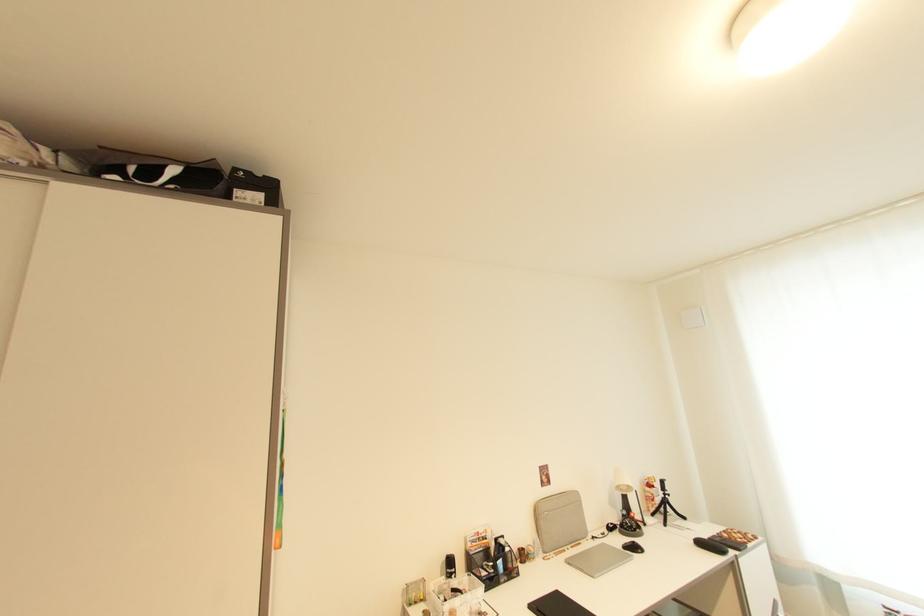
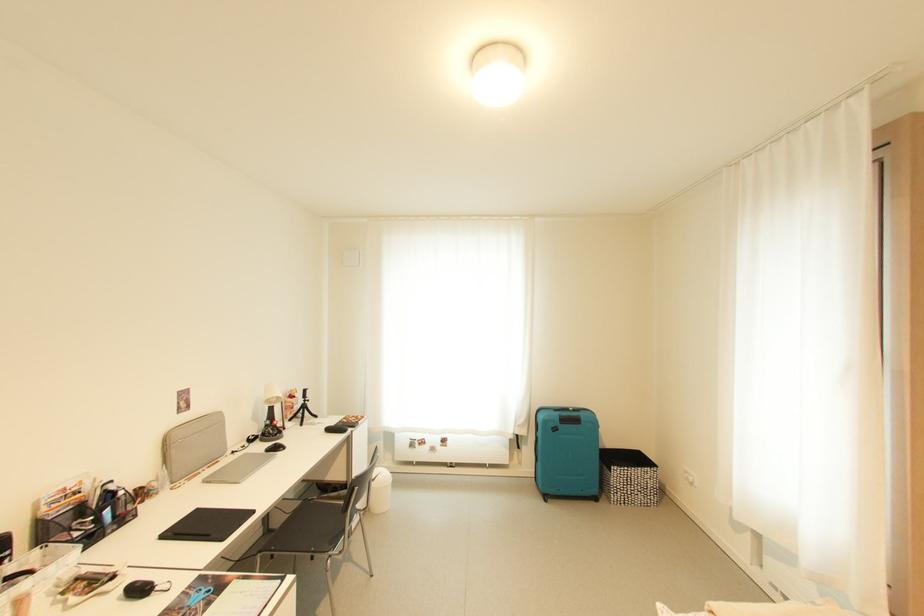
Question: I am providing you with two images of the same scene from different viewpoints. Which of the following objects are not visible in image2?

Choices:
 (A) chair sitting surface
 (B) black computer mouse
 (C) white desk lamp
 (D) none of these

Answer: (D)